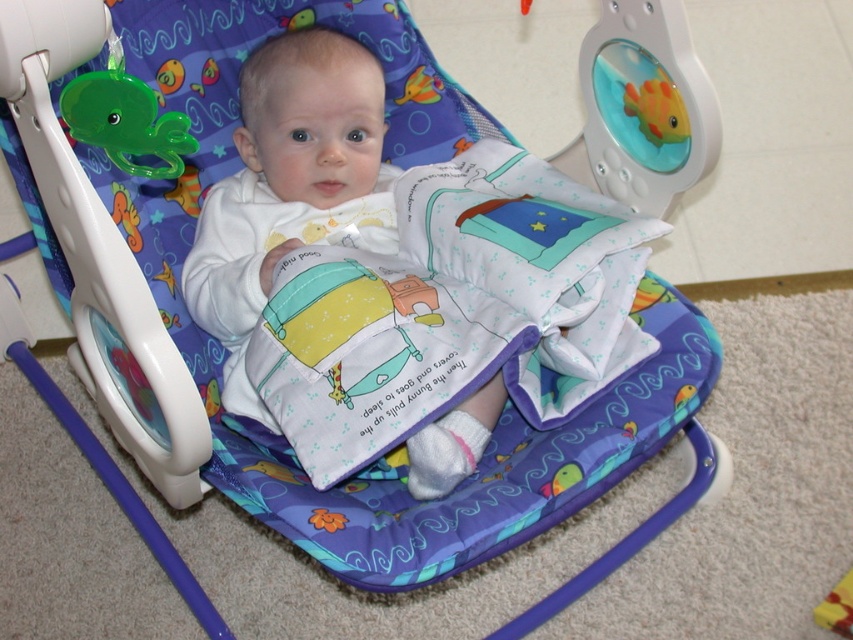
Question: Among these points, which one is farthest from the camera?

Choices:
 (A) (282, 141)
 (B) (149, 106)

Answer: (A)

Question: Is white soft baby at center wider than green plastic octopus at upper left?

Choices:
 (A) yes
 (B) no

Answer: (A)

Question: Does white soft baby at center have a smaller size compared to green plastic octopus at upper left?

Choices:
 (A) no
 (B) yes

Answer: (A)

Question: Is white soft baby at center bigger than green plastic octopus at upper left?

Choices:
 (A) yes
 (B) no

Answer: (A)

Question: Which object appears farthest from the camera in this image?

Choices:
 (A) white soft baby at center
 (B) green plastic octopus at upper left

Answer: (A)